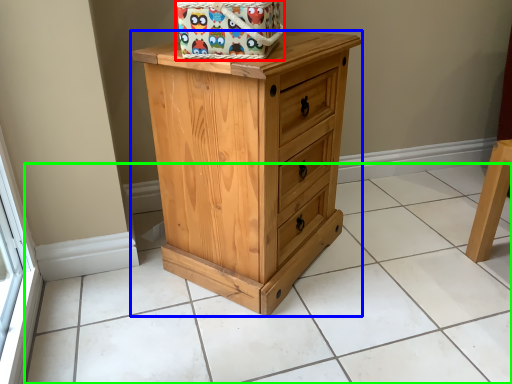
Question: Which object is positioned closest to gift basket (highlighted by a red box)? Select from chest of drawers (highlighted by a blue box) and tile (highlighted by a green box).

Choices:
 (A) chest of drawers
 (B) tile

Answer: (A)